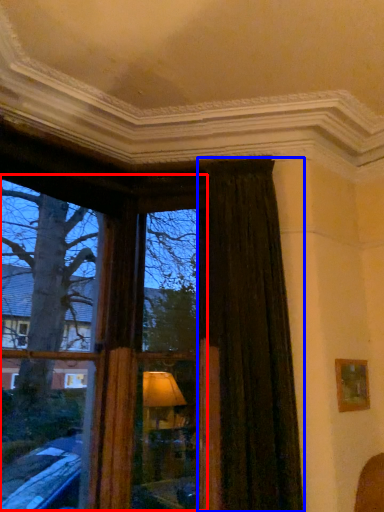
Question: Which point is closer to the camera, bay window (highlighted by a red box) or curtain (highlighted by a blue box)?

Choices:
 (A) bay window
 (B) curtain

Answer: (A)